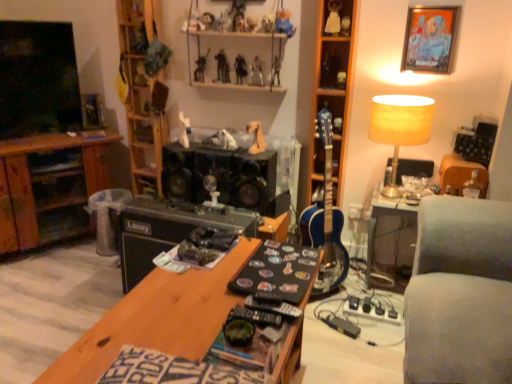
Question: From a real-world perspective, is shiny plastic action figure at upper center, placed as the tenth toy when sorted from right to left, physically below metallic figure at upper center, marked as the sixth toy in a left-to-right arrangement?

Choices:
 (A) yes
 (B) no

Answer: (A)

Question: From the image's perspective, is shiny plastic action figure at upper center, placed as the tenth toy when sorted from right to left, over metallic figure at upper center, the 11th toy from the right?

Choices:
 (A) yes
 (B) no

Answer: (B)

Question: Is shiny plastic action figure at upper center, positioned as the 7th toy in left-to-right order, not within metallic figure at upper center, marked as the sixth toy in a left-to-right arrangement?

Choices:
 (A) no
 (B) yes

Answer: (B)

Question: Considering the relative positions of shiny plastic action figure at upper center, placed as the tenth toy when sorted from right to left, and metallic figure at upper center, the 11th toy from the right, in the image provided, is shiny plastic action figure at upper center, placed as the tenth toy when sorted from right to left, to the right of metallic figure at upper center, the 11th toy from the right, from the viewer's perspective?

Choices:
 (A) yes
 (B) no

Answer: (A)

Question: From the image's perspective, is shiny plastic action figure at upper center, placed as the tenth toy when sorted from right to left, located beneath metallic figure at upper center, marked as the sixth toy in a left-to-right arrangement?

Choices:
 (A) no
 (B) yes

Answer: (B)

Question: In terms of width, does white plush bear at upper center, which is the fifteenth toy in left-to-right order, look wider or thinner when compared to brown wood cabinet at left?

Choices:
 (A) thin
 (B) wide

Answer: (A)

Question: Relative to brown wood cabinet at left, is white plush bear at upper center, the 2th toy positioned from the right, in front or behind?

Choices:
 (A) behind
 (B) front

Answer: (B)

Question: Does point (329, 26) appear closer or farther from the camera than point (10, 183)?

Choices:
 (A) closer
 (B) farther

Answer: (A)

Question: In the image, is white plush bear at upper center, the 2th toy positioned from the right, on the left side or the right side of brown wood cabinet at left?

Choices:
 (A) left
 (B) right

Answer: (B)

Question: In terms of height, does wooden at left, the third shelf viewed from the right, look taller or shorter compared to yellow fabric lampshade at upper right?

Choices:
 (A) tall
 (B) short

Answer: (A)

Question: From a real-world perspective, is wooden at left, which ranks as the 1th shelf in left-to-right order, physically located above or below yellow fabric lampshade at upper right?

Choices:
 (A) above
 (B) below

Answer: (A)

Question: Considering their positions, is wooden at left, the third shelf viewed from the right, located in front of or behind yellow fabric lampshade at upper right?

Choices:
 (A) behind
 (B) front

Answer: (A)

Question: Would you say wooden at left, the third shelf viewed from the right, is to the left or to the right of yellow fabric lampshade at upper right in the picture?

Choices:
 (A) right
 (B) left

Answer: (B)

Question: Is metallic silver action figure at upper center, the twelfth toy viewed from the left, bigger or smaller than clear plastic trash bin at center?

Choices:
 (A) small
 (B) big

Answer: (A)

Question: From the image's perspective, relative to clear plastic trash bin at center, is metallic silver action figure at upper center, which is the fifth toy in right-to-left order, above or below?

Choices:
 (A) below
 (B) above

Answer: (B)